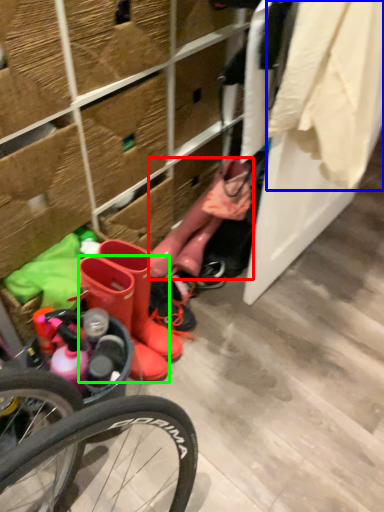
Question: Which is nearer to the boot (highlighted by a red box)? clothing (highlighted by a blue box) or footwear (highlighted by a green box).

Choices:
 (A) clothing
 (B) footwear

Answer: (B)